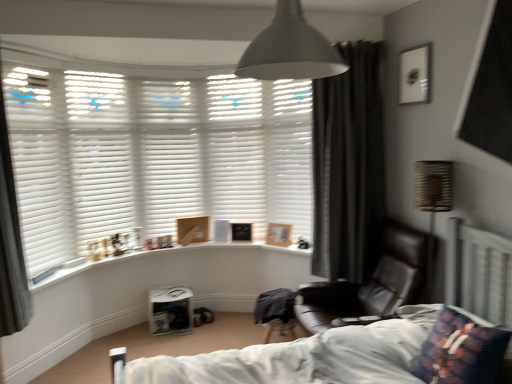
Question: Considering the relative sizes of matte black picture frame at upper right, which is the 1th picture frame in right-to-left order, and white matte blinds at left, the 1th shutter viewed from the left, in the image provided, is matte black picture frame at upper right, which is the 1th picture frame in right-to-left order, bigger than white matte blinds at left, the 1th shutter viewed from the left,?

Choices:
 (A) no
 (B) yes

Answer: (A)

Question: From the image's perspective, does matte black picture frame at upper right, the 4th picture frame when ordered from bottom to top, appear lower than white matte blinds at left, placed as the fifth shutter when sorted from right to left?

Choices:
 (A) yes
 (B) no

Answer: (B)

Question: Is matte black picture frame at upper right, acting as the 4th picture frame starting from the left, thinner than white matte blinds at left, placed as the fifth shutter when sorted from right to left?

Choices:
 (A) yes
 (B) no

Answer: (A)

Question: Is matte black picture frame at upper right, the 4th picture frame when ordered from bottom to top, not near white matte blinds at left, placed as the fifth shutter when sorted from right to left?

Choices:
 (A) no
 (B) yes

Answer: (B)

Question: Can we say matte black picture frame at upper right, positioned as the 1th picture frame in front-to-back order, lies outside white matte blinds at left, placed as the fifth shutter when sorted from right to left?

Choices:
 (A) yes
 (B) no

Answer: (A)

Question: From the image's perspective, is woven fabric table lamp at right located above or below matte gray lampshade at upper center?

Choices:
 (A) below
 (B) above

Answer: (A)

Question: Is woven fabric table lamp at right bigger or smaller than matte gray lampshade at upper center?

Choices:
 (A) small
 (B) big

Answer: (B)

Question: Considering the positions of woven fabric table lamp at right and matte gray lampshade at upper center in the image, is woven fabric table lamp at right taller or shorter than matte gray lampshade at upper center?

Choices:
 (A) short
 (B) tall

Answer: (B)

Question: From a real-world perspective, relative to matte gray lampshade at upper center, is woven fabric table lamp at right vertically above or below?

Choices:
 (A) below
 (B) above

Answer: (A)

Question: Looking at their shapes, would you say dark grey curtain at right, positioned as the 2th curtain in front-to-back order, is wider or thinner than black leather chair at lower right?

Choices:
 (A) wide
 (B) thin

Answer: (B)

Question: Considering their positions, is dark grey curtain at right, positioned as the 2th curtain in front-to-back order, located in front of or behind black leather chair at lower right?

Choices:
 (A) behind
 (B) front

Answer: (A)

Question: From the image's perspective, is dark grey curtain at right, positioned as the 2th curtain in front-to-back order, located above or below black leather chair at lower right?

Choices:
 (A) above
 (B) below

Answer: (A)

Question: Do you think dark grey curtain at right, positioned as the 2th curtain in front-to-back order, is within black leather chair at lower right, or outside of it?

Choices:
 (A) outside
 (B) inside

Answer: (A)

Question: Is point (295, 52) positioned closer to the camera than point (121, 165)?

Choices:
 (A) closer
 (B) farther

Answer: (A)

Question: Is matte gray lampshade at upper center situated inside white matte blinds at upper left, which ranks as the 4th shutter in right-to-left order, or outside?

Choices:
 (A) inside
 (B) outside

Answer: (B)